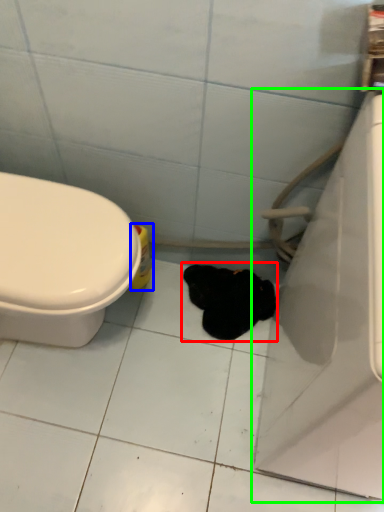
Question: Which object is positioned farthest from animal (highlighted by a red box)? Select from cleaning product (highlighted by a blue box) and bath (highlighted by a green box).

Choices:
 (A) cleaning product
 (B) bath

Answer: (B)